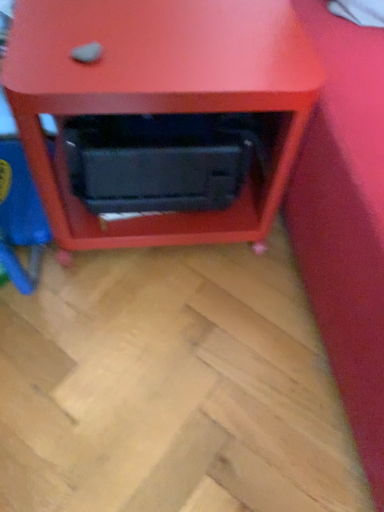
I want to click on blank space situated above matte black microwave at center (from a real-world perspective), so click(156, 29).